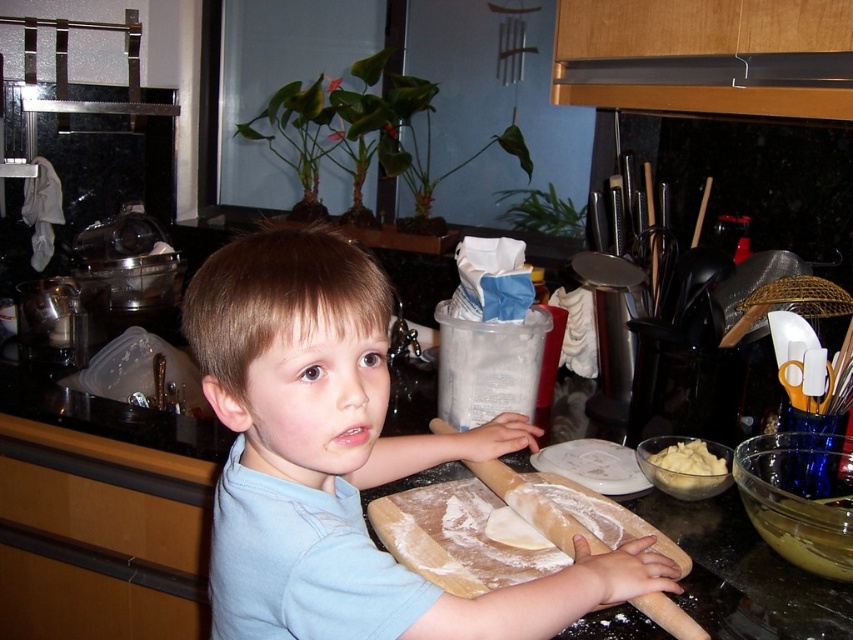
What is the exact coordinate of the light blue cotton shirt at center?

The light blue cotton shirt at center is located at point (344,461).